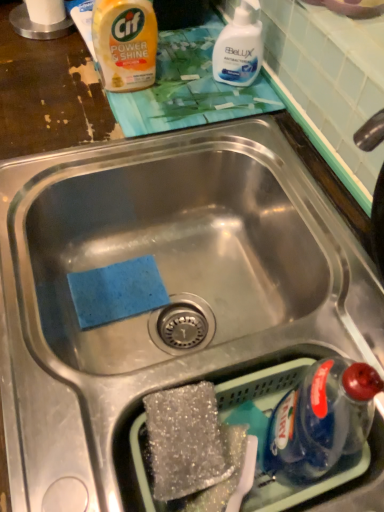
Question: Does white glossy liquid at upper center appear on the right side of yellow plastic bottle at upper left?

Choices:
 (A) yes
 (B) no

Answer: (A)

Question: From a real-world perspective, does white glossy liquid at upper center stand above yellow plastic bottle at upper left?

Choices:
 (A) yes
 (B) no

Answer: (B)

Question: Would you consider white glossy liquid at upper center to be distant from yellow plastic bottle at upper left?

Choices:
 (A) no
 (B) yes

Answer: (A)

Question: Is white glossy liquid at upper center bigger than yellow plastic bottle at upper left?

Choices:
 (A) yes
 (B) no

Answer: (B)

Question: Is white glossy liquid at upper center behind yellow plastic bottle at upper left?

Choices:
 (A) no
 (B) yes

Answer: (B)

Question: Is white glossy liquid at upper center oriented away from yellow plastic bottle at upper left?

Choices:
 (A) yes
 (B) no

Answer: (B)

Question: Considering the relative sizes of yellow plastic bottle at upper left and white glossy liquid at upper center in the image provided, is yellow plastic bottle at upper left shorter than white glossy liquid at upper center?

Choices:
 (A) yes
 (B) no

Answer: (B)

Question: Can you confirm if yellow plastic bottle at upper left is taller than white glossy liquid at upper center?

Choices:
 (A) yes
 (B) no

Answer: (A)

Question: From a real-world perspective, is yellow plastic bottle at upper left located higher than white glossy liquid at upper center?

Choices:
 (A) no
 (B) yes

Answer: (B)

Question: From the image's perspective, would you say yellow plastic bottle at upper left is positioned over white glossy liquid at upper center?

Choices:
 (A) no
 (B) yes

Answer: (B)

Question: Can we say yellow plastic bottle at upper left lies outside white glossy liquid at upper center?

Choices:
 (A) yes
 (B) no

Answer: (A)

Question: From the image's perspective, would you say yellow plastic bottle at upper left is shown under white glossy liquid at upper center?

Choices:
 (A) yes
 (B) no

Answer: (B)

Question: Is the depth of white glossy liquid at upper center less than that of sparkly silver sponge at bottom center?

Choices:
 (A) no
 (B) yes

Answer: (A)